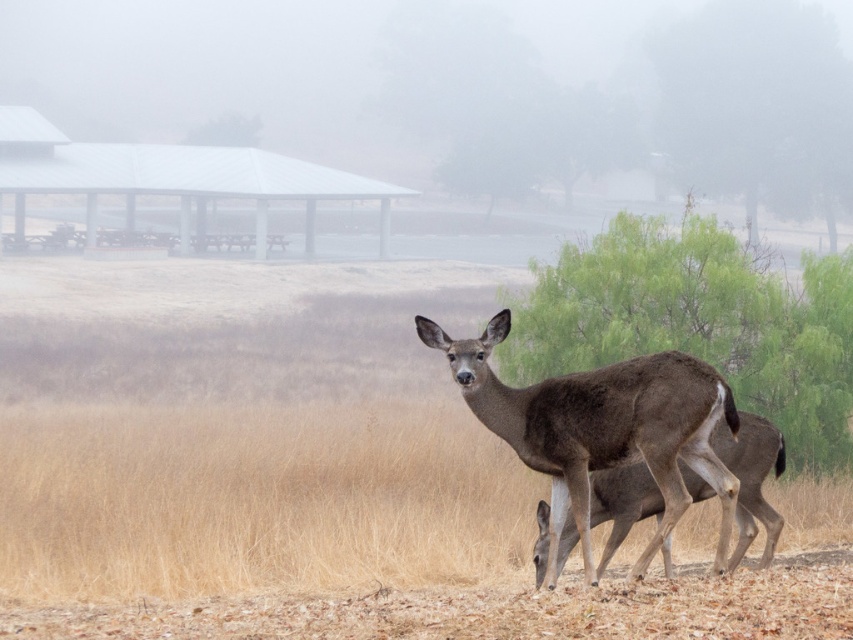
Is brown fur deer at center to the right of brown matte/deer at center from the viewer's perspective?

In fact, brown fur deer at center is to the left of brown matte/deer at center.

The height and width of the screenshot is (640, 853). In order to click on brown fur deer at center in this screenshot , I will do `click(602, 428)`.

Which is more to the left, brown fur deer at center or white plastic shelter at upper left?

white plastic shelter at upper left

Who is lower down, brown fur deer at center or white plastic shelter at upper left?

brown fur deer at center

Is point (509, 387) less distant than point (325, 173)?

Yes, point (509, 387) is in front of point (325, 173).

Identify the location of brown fur deer at center. (602, 428).

Measure the distance between white plastic shelter at upper left and brown matte/deer at center.

A distance of 46.67 meters exists between white plastic shelter at upper left and brown matte/deer at center.

Between point (32, 125) and point (749, 433), which one is positioned behind?

The point (32, 125) is behind.

Which is behind, point (260, 156) or point (708, 484)?

Positioned behind is point (260, 156).

Find the location of a particular element. white plastic shelter at upper left is located at coordinates (172, 176).